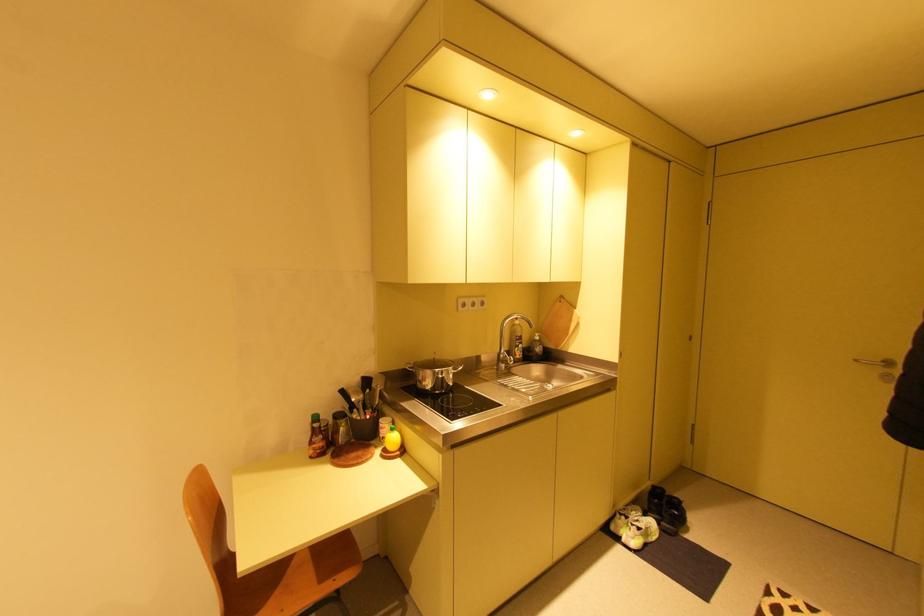
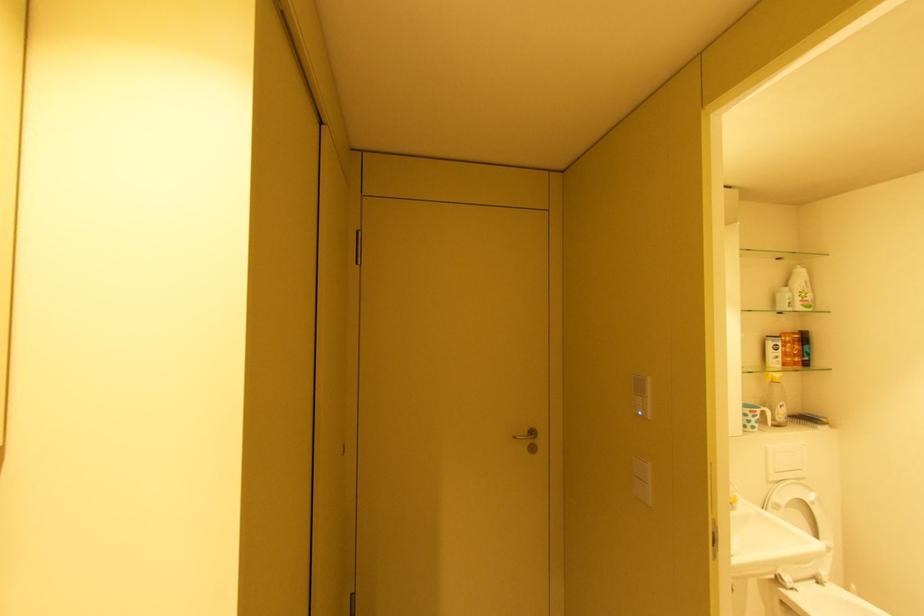
The point at (861, 361) is marked in the first image. Where is the corresponding point in the second image?

(520, 438)